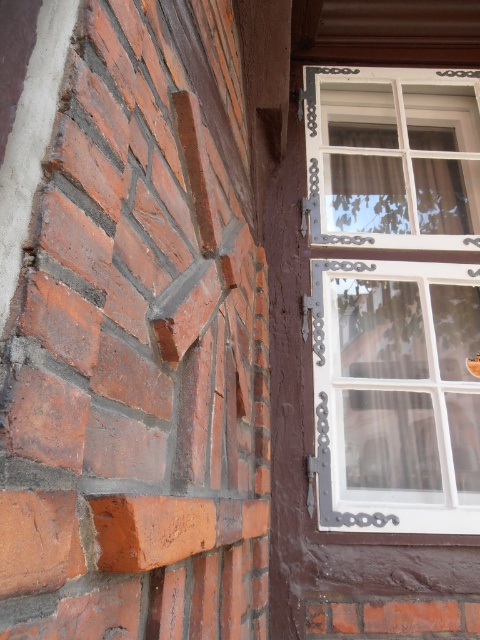
Question: Is white painted wood window at upper right bigger than red clay brick at lower right?

Choices:
 (A) yes
 (B) no

Answer: (A)

Question: Which point is closer to the camera?

Choices:
 (A) smooth orange brick at lower left
 (B) white matte window at right
 (C) red brick at left
 (D) white painted wood window at upper right

Answer: (C)

Question: Does red brick at left appear on the right side of smooth orange brick at lower left?

Choices:
 (A) no
 (B) yes

Answer: (B)

Question: Which point appears closest to the camera in this image?

Choices:
 (A) 151,515
 (B) 391,204

Answer: (A)

Question: Does red brick at left have a smaller size compared to red clay brick at lower right?

Choices:
 (A) no
 (B) yes

Answer: (A)

Question: Which object is the closest to the smooth orange brick at lower left?

Choices:
 (A) white painted wood window at upper right
 (B) red brick at left
 (C) red clay brick at lower right
 (D) white matte window at right

Answer: (B)